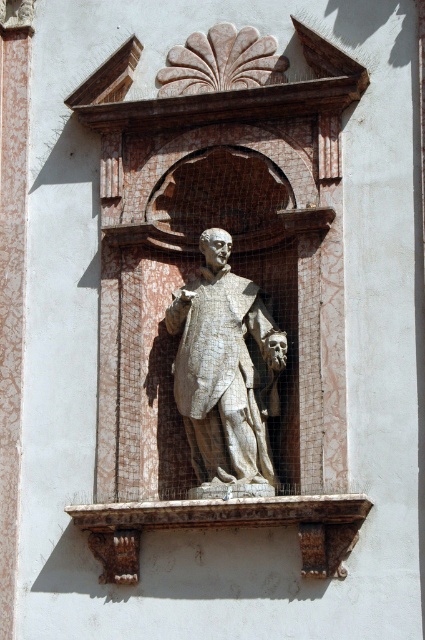
Does white marble statue at center appear on the right side of rustic stone ledge at center?

Incorrect, white marble statue at center is not on the right side of rustic stone ledge at center.

Does white marble statue at center appear under rustic stone ledge at center?

No.

Where is `white marble statue at center`? The image size is (425, 640). white marble statue at center is located at coordinates (224, 369).